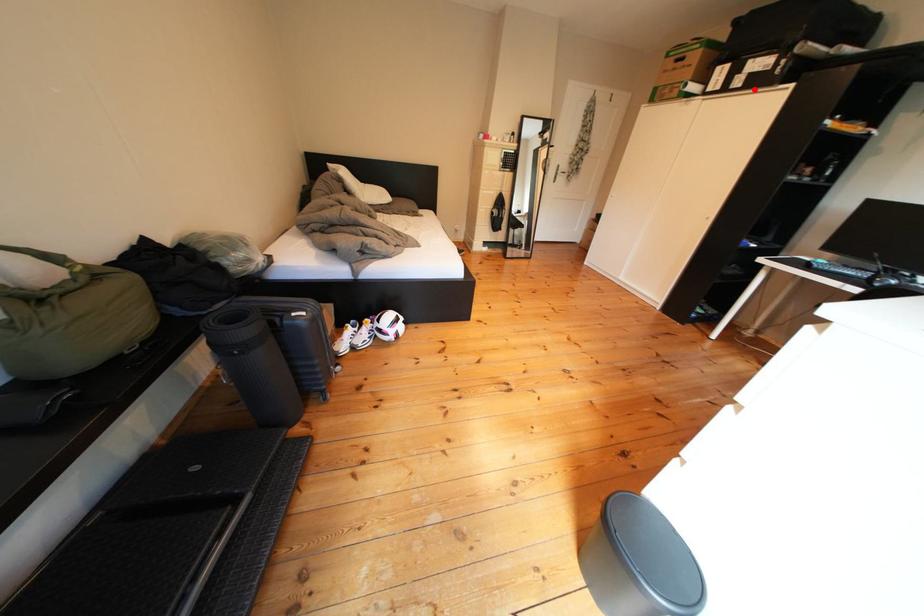
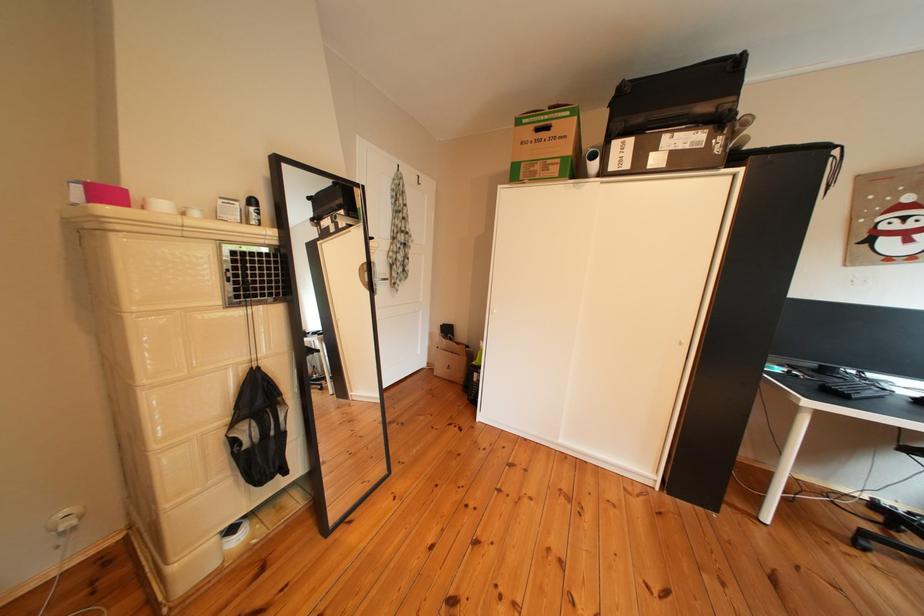
In the second image, find the point that corresponds to the highlighted location in the first image.

(676, 169)